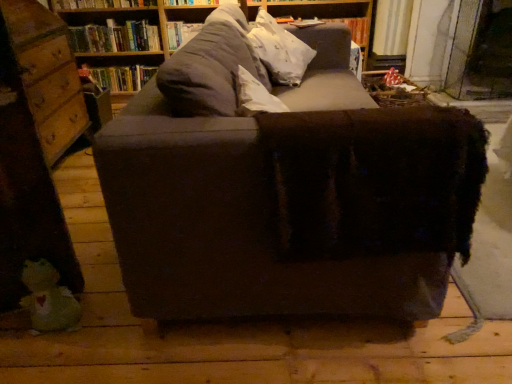
What do you see at coordinates (119, 77) in the screenshot?
I see `hardcover book at upper left, positioned as the first book in bottom-to-top order` at bounding box center [119, 77].

What are the coordinates of `hardcover book at upper left, acting as the second book starting from the top` in the screenshot? It's located at (119, 77).

The image size is (512, 384). Describe the element at coordinates (289, 208) in the screenshot. I see `dark brown fabric couch at center` at that location.

This screenshot has width=512, height=384. Describe the element at coordinates (481, 51) in the screenshot. I see `transparent glass door at upper right` at that location.

Find the location of a particular element. The image size is (512, 384). green plush toy at lower left is located at coordinates (48, 298).

The width and height of the screenshot is (512, 384). I want to click on wooden bookshelf at upper center, so click(127, 38).

Locate an element on the screen. hardcover book at upper center, the second book from the bottom is located at coordinates (115, 37).

The width and height of the screenshot is (512, 384). What do you see at coordinates (46, 74) in the screenshot?
I see `wooden drawer at left` at bounding box center [46, 74].

This screenshot has width=512, height=384. I want to click on hardcover book at upper left, acting as the second book starting from the top, so click(119, 77).

Between wooden drawer at left and transparent glass door at upper right, which one is positioned behind?

transparent glass door at upper right is more distant.

Does wooden drawer at left have a greater width compared to transparent glass door at upper right?

Correct, the width of wooden drawer at left exceeds that of transparent glass door at upper right.

The width and height of the screenshot is (512, 384). I want to click on glass door on the right of wooden drawer at left, so pos(481,51).

Find the location of a particular element. This screenshot has height=384, width=512. the 1st book behind the wooden drawer at left, starting your count from the anchor is located at coordinates (115, 37).

From the image's perspective, which object appears higher, hardcover book at upper center, the second book from the bottom, or wooden drawer at left?

hardcover book at upper center, the second book from the bottom.

Is hardcover book at upper center, the second book from the bottom, directly adjacent to wooden drawer at left?

hardcover book at upper center, the second book from the bottom, and wooden drawer at left are not in contact.

Is hardcover book at upper left, acting as the second book starting from the top, placed right next to white cotton throw pillow at upper center?

No, hardcover book at upper left, acting as the second book starting from the top, is not touching white cotton throw pillow at upper center.

Is point (144, 77) positioned before point (282, 33)?

No, it is behind (282, 33).

Is hardcover book at upper left, positioned as the first book in bottom-to-top order, to the right of white cotton throw pillow at upper center from the viewer's perspective?

In fact, hardcover book at upper left, positioned as the first book in bottom-to-top order, is to the left of white cotton throw pillow at upper center.

How different are the orientations of hardcover book at upper left, acting as the second book starting from the top, and white cotton throw pillow at upper center in degrees?

They differ by 88.9 degrees in their facing directions.

From their relative heights in the image, would you say green plush toy at lower left is taller or shorter than hardcover book at upper left, acting as the second book starting from the top?

Considering their sizes, green plush toy at lower left has more height than hardcover book at upper left, acting as the second book starting from the top.

Can you confirm if green plush toy at lower left is positioned to the right of hardcover book at upper left, positioned as the first book in bottom-to-top order?

Yes.

Which is less distant, (61, 318) or (130, 66)?

Point (61, 318)

Between wooden bookshelf at upper center and hardcover book at upper left, acting as the second book starting from the top, which one has larger size?

wooden bookshelf at upper center.

Is wooden bookshelf at upper center positioned beyond the bounds of hardcover book at upper left, acting as the second book starting from the top?

Yes, wooden bookshelf at upper center is located beyond the bounds of hardcover book at upper left, acting as the second book starting from the top.

Is wooden bookshelf at upper center in front of or behind hardcover book at upper left, acting as the second book starting from the top, in the image?

Clearly, wooden bookshelf at upper center is in front of hardcover book at upper left, acting as the second book starting from the top.

Which is more to the left, wooden bookshelf at upper center or hardcover book at upper left, positioned as the first book in bottom-to-top order?

hardcover book at upper left, positioned as the first book in bottom-to-top order, is more to the left.

Is point (73, 41) less distant than point (90, 44)?

Yes, point (73, 41) is in front of point (90, 44).

Do you think hardcover book at upper center, the second book from the bottom, is within wooden bookshelf at upper center, or outside of it?

hardcover book at upper center, the second book from the bottom, can be found inside wooden bookshelf at upper center.

Is hardcover book at upper center, the second book from the bottom, facing away from wooden bookshelf at upper center?

Yes, wooden bookshelf at upper center is at the back of hardcover book at upper center, the second book from the bottom.

Considering the relative positions of wooden drawer at left and wooden bookshelf at upper center in the image provided, is wooden drawer at left to the right of wooden bookshelf at upper center from the viewer's perspective?

No.

From the image's perspective, which is above, wooden drawer at left or wooden bookshelf at upper center?

wooden bookshelf at upper center is shown above in the image.

Is wooden drawer at left oriented away from wooden bookshelf at upper center?

wooden drawer at left is not turned away from wooden bookshelf at upper center.

In terms of size, does wooden drawer at left appear bigger or smaller than wooden bookshelf at upper center?

wooden drawer at left is smaller than wooden bookshelf at upper center.

What are the coordinates of `glass door above the wooden drawer at left (from the image's perspective)` in the screenshot? It's located at (481, 51).

Image resolution: width=512 pixels, height=384 pixels. Identify the location of book above the wooden drawer at left (from a real-world perspective). (115, 37).

Which object lies further to the anchor point green plush toy at lower left, wooden drawer at left or dark brown fabric couch at center?

wooden drawer at left is positioned further to the anchor green plush toy at lower left.

When comparing their distances from wooden drawer at left, does hardcover book at upper center, acting as the first book starting from the top, or white cotton throw pillow at upper center seem further?

white cotton throw pillow at upper center lies further to wooden drawer at left than the other object.

Which object lies nearer to the anchor point wooden bookshelf at upper center, dark brown fabric couch at center or hardcover book at upper left, positioned as the first book in bottom-to-top order?

hardcover book at upper left, positioned as the first book in bottom-to-top order.

Based on their spatial positions, is hardcover book at upper center, the second book from the bottom, or white cotton throw pillow at upper center closer to transparent glass door at upper right?

white cotton throw pillow at upper center is closer to transparent glass door at upper right.

Considering their positions, is green plush toy at lower left positioned closer to hardcover book at upper center, the second book from the bottom, than hardcover book at upper left, acting as the second book starting from the top?

hardcover book at upper left, acting as the second book starting from the top, lies closer to hardcover book at upper center, the second book from the bottom, than the other object.

Based on the photo, estimate the real-world distances between objects in this image. Which object is closer to transparent glass door at upper right, hardcover book at upper center, the second book from the bottom, or hardcover book at upper left, acting as the second book starting from the top?

hardcover book at upper center, the second book from the bottom.

Estimate the real-world distances between objects in this image. Which object is further from wooden drawer at left, wooden bookshelf at upper center or hardcover book at upper center, the second book from the bottom?

hardcover book at upper center, the second book from the bottom.

Considering their positions, is wooden bookshelf at upper center positioned closer to transparent glass door at upper right than hardcover book at upper center, acting as the first book starting from the top?

Among the two, wooden bookshelf at upper center is located nearer to transparent glass door at upper right.

What are the coordinates of `throw pillow between hardcover book at upper left, positioned as the first book in bottom-to-top order, and transparent glass door at upper right from left to right` in the screenshot? It's located at (280, 50).

Image resolution: width=512 pixels, height=384 pixels. What are the coordinates of `studio couch located between wooden drawer at left and white cotton throw pillow at upper center in the left-right direction` in the screenshot? It's located at (289, 208).

Find the location of a particular element. throw pillow situated between wooden drawer at left and transparent glass door at upper right from left to right is located at coordinates (x=280, y=50).

I want to click on studio couch between green plush toy at lower left and transparent glass door at upper right in the horizontal direction, so click(x=289, y=208).